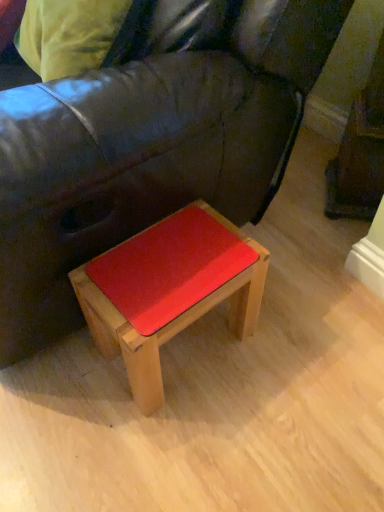
Question: From the image's perspective, is wooden stool at lower center located above or below leather couch at center?

Choices:
 (A) below
 (B) above

Answer: (A)

Question: Would you say wooden stool at lower center is inside or outside leather couch at center?

Choices:
 (A) outside
 (B) inside

Answer: (B)

Question: Considering their positions, is wooden stool at lower center located in front of or behind leather couch at center?

Choices:
 (A) front
 (B) behind

Answer: (B)

Question: Which is correct: leather couch at center is inside wooden stool at lower center, or outside of it?

Choices:
 (A) outside
 (B) inside

Answer: (A)

Question: Is point (233, 126) positioned closer to the camera than point (254, 245)?

Choices:
 (A) closer
 (B) farther

Answer: (A)

Question: In the image, is leather couch at center positioned in front of or behind wooden stool at lower center?

Choices:
 (A) front
 (B) behind

Answer: (A)

Question: Is leather couch at center to the left or to the right of wooden stool at lower center in the image?

Choices:
 (A) right
 (B) left

Answer: (B)